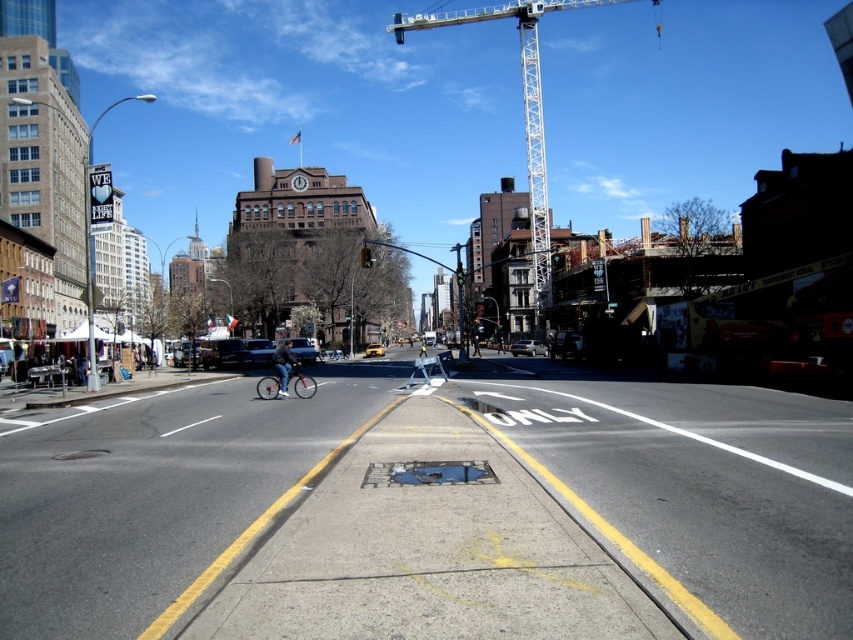
Which is above, white metallic crane at upper center or shiny silver bicycle at center?

white metallic crane at upper center is higher up.

Describe the element at coordinates (523, 109) in the screenshot. I see `white metallic crane at upper center` at that location.

Identify the location of white metallic crane at upper center. This screenshot has width=853, height=640. (523, 109).

Between shiny silver bicycle at center and metallic silver car at center, which one is positioned lower?

shiny silver bicycle at center

Is point (305, 387) farther from camera compared to point (553, 353)?

No, it is not.

Where is `shiny silver bicycle at center`? The width and height of the screenshot is (853, 640). shiny silver bicycle at center is located at coordinates (300, 381).

Who is lower down, white metallic crane at upper center or yellow rubber car at center?

yellow rubber car at center is below.

How far apart are white metallic crane at upper center and yellow rubber car at center?

A distance of 211.70 meters exists between white metallic crane at upper center and yellow rubber car at center.

Locate an element on the screen. The image size is (853, 640). white metallic crane at upper center is located at coordinates (523, 109).